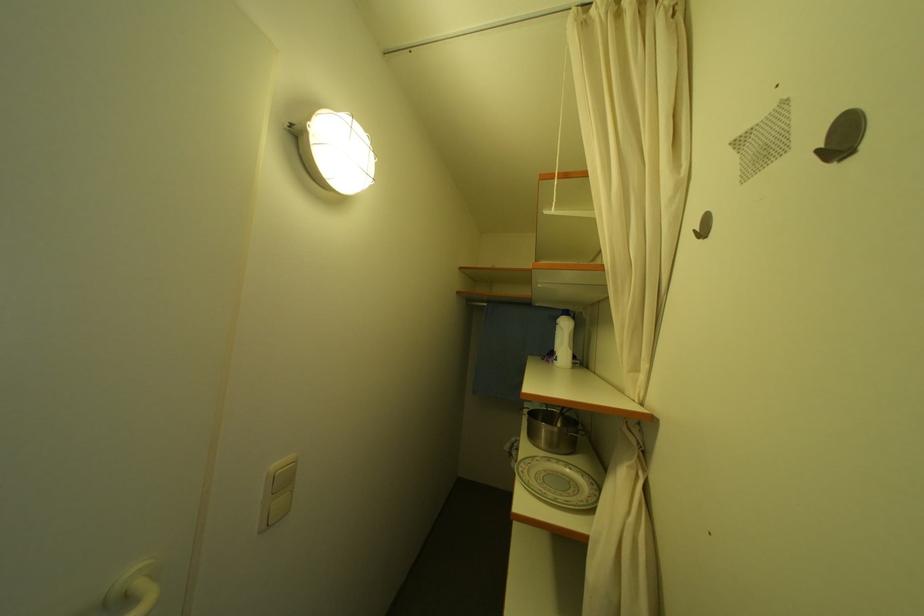
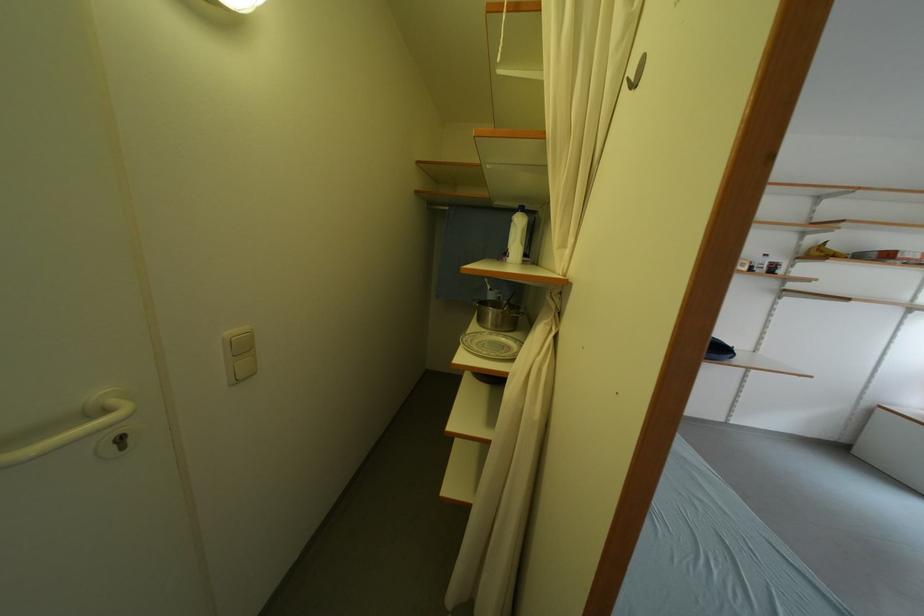
Find the pixel in the second image that matches point 530,468 in the first image.

(476, 339)